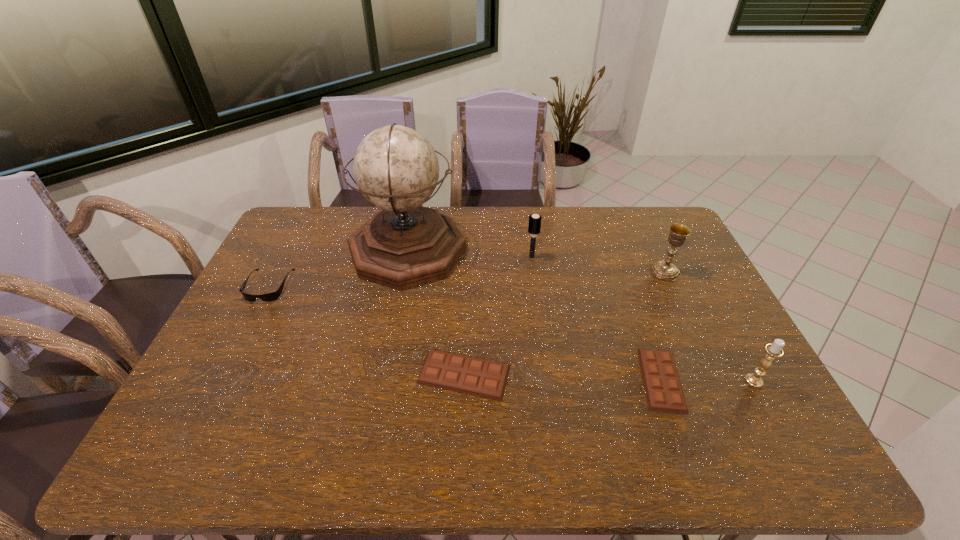
This screenshot has width=960, height=540. I want to click on candle holder that is at the right edge, so click(x=774, y=350).

Identify the location of vacant region at the far edge. (617, 241).

In the image, there is a desktop. Where is `free space at the near edge`? free space at the near edge is located at coordinates (525, 408).

Where is `vacant space at the right edge of the desktop`? The width and height of the screenshot is (960, 540). vacant space at the right edge of the desktop is located at coordinates (711, 339).

Locate an element on the screen. vacant space at the far left corner of the desktop is located at coordinates (310, 224).

Where is `blank space at the near right corner of the desktop`? Image resolution: width=960 pixels, height=540 pixels. blank space at the near right corner of the desktop is located at coordinates (739, 390).

Locate an element on the screen. The height and width of the screenshot is (540, 960). vacant space in between the second object from right to left and the leftmost object is located at coordinates (467, 279).

Locate an element on the screen. This screenshot has width=960, height=540. free space between the fourth object from right to left and the tallest object is located at coordinates (469, 254).

Identify the location of free space between the tallest object and the chalice. This screenshot has height=540, width=960. (537, 261).

The image size is (960, 540). Find the location of `empty space that is in between the leftmost object and the second shortest object`. empty space that is in between the leftmost object and the second shortest object is located at coordinates (367, 330).